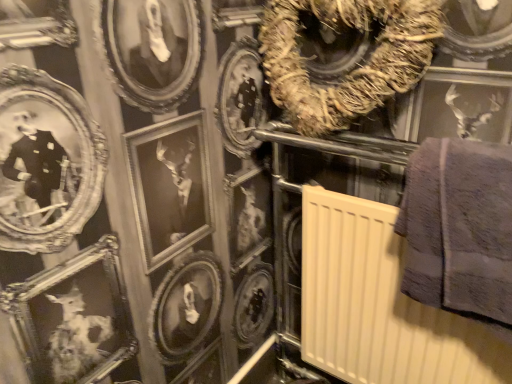
What is the approximate height of brown textured wreath at upper center?

Answer: The height of brown textured wreath at upper center is 12.26 inches.

Identify the location of gray fluffy towel at right. (459, 228).

Find the location of a particular element. This screenshot has width=512, height=384. beige plastic radiator at center-right is located at coordinates (379, 304).

In order to click on brown textured wreath at upper center in this screenshot , I will do `click(352, 62)`.

Which object is further away from the camera taking this photo, brown textured wreath at upper center or beige plastic radiator at center-right?

brown textured wreath at upper center is more distant.

Is brown textured wreath at upper center beside beige plastic radiator at center-right?

No, brown textured wreath at upper center is not in contact with beige plastic radiator at center-right.

From a real-world perspective, who is located lower, brown textured wreath at upper center or beige plastic radiator at center-right?

beige plastic radiator at center-right.

Who is taller, brown textured wreath at upper center or beige plastic radiator at center-right?

Standing taller between the two is beige plastic radiator at center-right.

Which is in front, beige plastic radiator at center-right or gray fluffy towel at right?

gray fluffy towel at right is closer to the camera.

Considering the sizes of objects beige plastic radiator at center-right and gray fluffy towel at right in the image provided, who is wider, beige plastic radiator at center-right or gray fluffy towel at right?

Wider between the two is beige plastic radiator at center-right.

Can you confirm if beige plastic radiator at center-right is positioned to the right of gray fluffy towel at right?

In fact, beige plastic radiator at center-right is to the left of gray fluffy towel at right.

Considering the sizes of objects brown textured wreath at upper center and gray fluffy towel at right in the image provided, who is wider, brown textured wreath at upper center or gray fluffy towel at right?

With larger width is gray fluffy towel at right.

Are brown textured wreath at upper center and gray fluffy towel at right making contact?

brown textured wreath at upper center and gray fluffy towel at right are not in contact.

Considering the relative sizes of brown textured wreath at upper center and gray fluffy towel at right in the image provided, is brown textured wreath at upper center smaller than gray fluffy towel at right?

Incorrect, brown textured wreath at upper center is not smaller in size than gray fluffy towel at right.

From the image's perspective, is brown textured wreath at upper center above gray fluffy towel at right?

Yes.

Considering the sizes of objects gray fluffy towel at right and beige plastic radiator at center-right in the image provided, who is smaller, gray fluffy towel at right or beige plastic radiator at center-right?

gray fluffy towel at right.

Which object is thinner, gray fluffy towel at right or beige plastic radiator at center-right?

With smaller width is gray fluffy towel at right.

Considering the relative positions of gray fluffy towel at right and beige plastic radiator at center-right in the image provided, is gray fluffy towel at right to the left or to the right of beige plastic radiator at center-right?

Based on their positions, gray fluffy towel at right is located to the right of beige plastic radiator at center-right.

Is the depth of beige plastic radiator at center-right greater than that of brown textured wreath at upper center?

No, beige plastic radiator at center-right is in front of brown textured wreath at upper center.

Does beige plastic radiator at center-right have a smaller size compared to brown textured wreath at upper center?

No.

How different are the orientations of beige plastic radiator at center-right and brown textured wreath at upper center in degrees?

0.076 degrees.

The width and height of the screenshot is (512, 384). What are the coordinates of `decor lying on the left of beige plastic radiator at center-right` in the screenshot? It's located at (352, 62).

Is gray fluffy towel at right taller than brown textured wreath at upper center?

Indeed, gray fluffy towel at right has a greater height compared to brown textured wreath at upper center.

The image size is (512, 384). Find the location of `towel that is below the brown textured wreath at upper center (from the image's perspective)`. towel that is below the brown textured wreath at upper center (from the image's perspective) is located at coordinates (459, 228).

Which is further, (484, 286) or (298, 70)?

Point (298, 70)

Who is smaller, gray fluffy towel at right or brown textured wreath at upper center?

Smaller between the two is gray fluffy towel at right.

Identify the location of decor on the left of beige plastic radiator at center-right. (352, 62).

This screenshot has height=384, width=512. I want to click on towel in front of the beige plastic radiator at center-right, so click(x=459, y=228).

Which object lies further to the anchor point beige plastic radiator at center-right, brown textured wreath at upper center or gray fluffy towel at right?

brown textured wreath at upper center lies further to beige plastic radiator at center-right than the other object.

From the image, which object appears to be farther from brown textured wreath at upper center, gray fluffy towel at right or beige plastic radiator at center-right?

The object further to brown textured wreath at upper center is beige plastic radiator at center-right.

Looking at the image, which one is located further to beige plastic radiator at center-right, gray fluffy towel at right or brown textured wreath at upper center?

Among the two, brown textured wreath at upper center is located further to beige plastic radiator at center-right.

From the image, which object appears to be farther from brown textured wreath at upper center, beige plastic radiator at center-right or gray fluffy towel at right?

beige plastic radiator at center-right is positioned further to the anchor brown textured wreath at upper center.

Based on their spatial positions, is brown textured wreath at upper center or beige plastic radiator at center-right further from gray fluffy towel at right?

brown textured wreath at upper center lies further to gray fluffy towel at right than the other object.

Based on their spatial positions, is beige plastic radiator at center-right or brown textured wreath at upper center closer to gray fluffy towel at right?

The object closer to gray fluffy towel at right is beige plastic radiator at center-right.

Find the location of `towel between brown textured wreath at upper center and beige plastic radiator at center-right in the up-down direction`. towel between brown textured wreath at upper center and beige plastic radiator at center-right in the up-down direction is located at coordinates (459, 228).